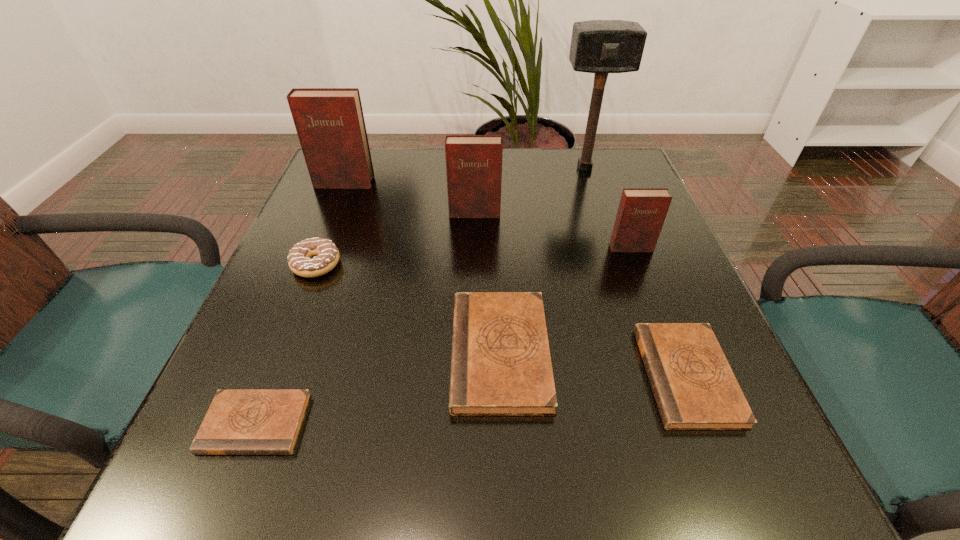
Identify the location of the farthest object. (597, 46).

Identify the location of mallet. (597, 46).

The width and height of the screenshot is (960, 540). Find the location of `the leftmost reddish-brown diary`. the leftmost reddish-brown diary is located at coordinates (330, 124).

At what (x,y) coordinates should I click in order to perform the action: click on the second farthest object. Please return your answer as a coordinate pair (x, y). The width and height of the screenshot is (960, 540). Looking at the image, I should click on (330, 124).

At what (x,y) coordinates should I click in order to perform the action: click on the second biggest reddish-brown diary. Please return your answer as a coordinate pair (x, y). The height and width of the screenshot is (540, 960). Looking at the image, I should click on (473, 162).

Locate an element on the screen. the sixth shortest object is located at coordinates (473, 162).

Where is `the fourth tallest object`? the fourth tallest object is located at coordinates (x=641, y=213).

At what (x,y) coordinates should I click in order to perform the action: click on the fourth nearest diary. Please return your answer as a coordinate pair (x, y). Looking at the image, I should click on (641, 213).

This screenshot has height=540, width=960. I want to click on chocolate doughnut, so click(x=300, y=260).

The width and height of the screenshot is (960, 540). I want to click on doughnut, so click(300, 260).